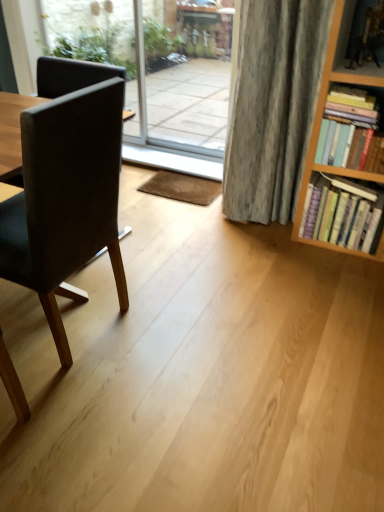
The width and height of the screenshot is (384, 512). Find the location of `free space that is in between hardcover books at right, arranged as the first book when ordered from the bottom, and matte black chair at left`. free space that is in between hardcover books at right, arranged as the first book when ordered from the bottom, and matte black chair at left is located at coordinates (223, 277).